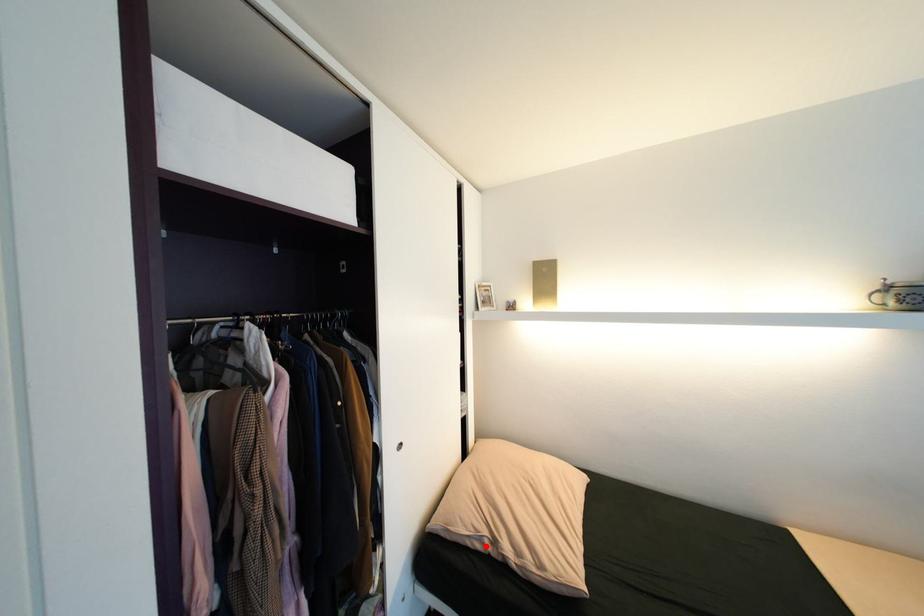
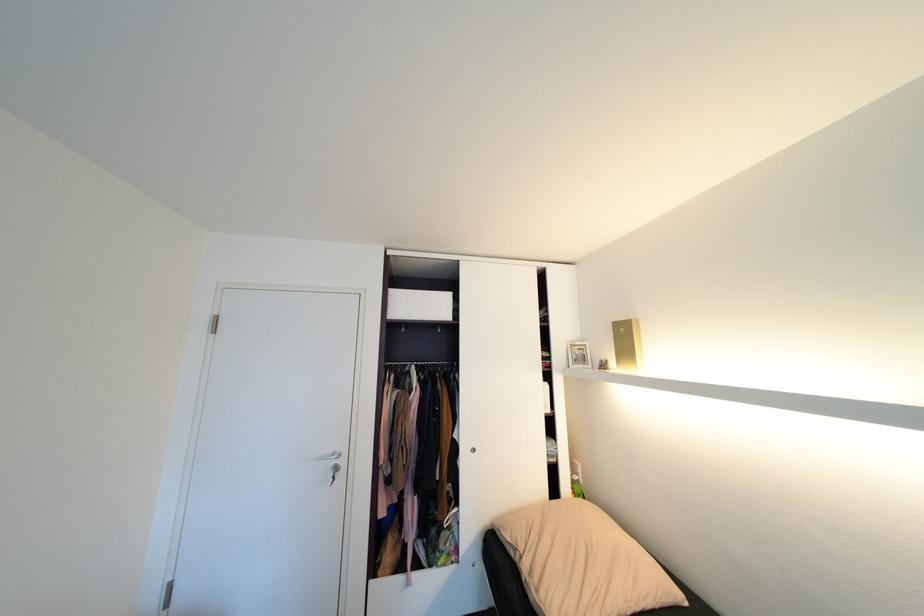
In the second image, find the point that corresponds to the highlighted location in the first image.

(518, 554)